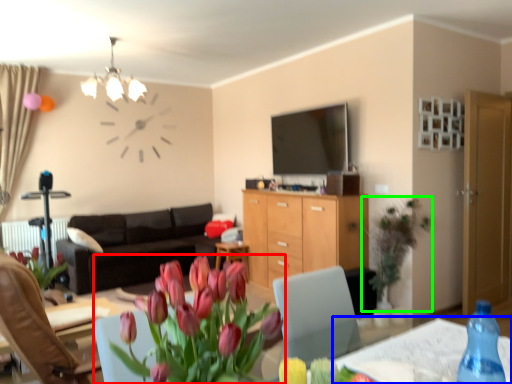
Question: Based on their relative distances, which object is farther from houseplant (highlighted by a red box)? Choose from round table (highlighted by a blue box) and floral arrangement (highlighted by a green box).

Choices:
 (A) round table
 (B) floral arrangement

Answer: (B)